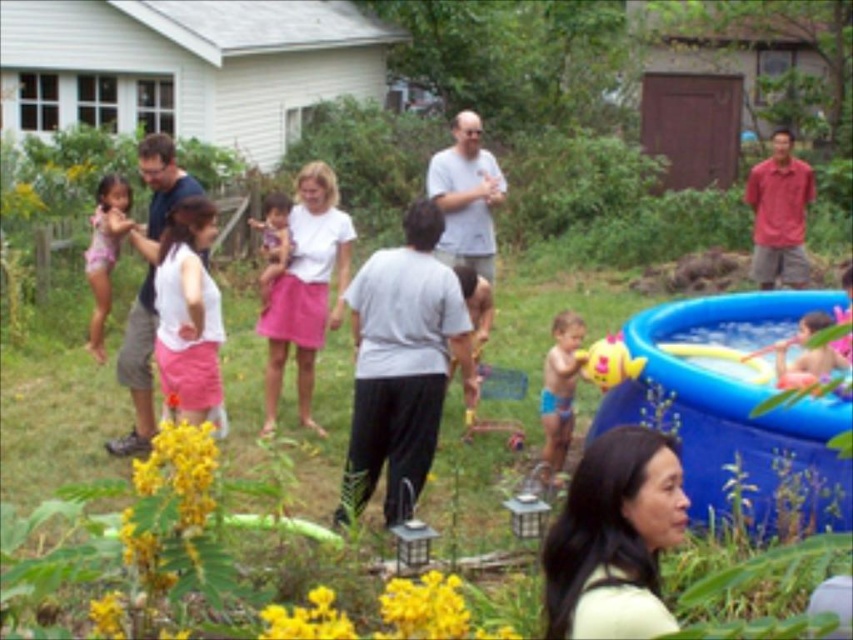
You are a parent at the gathering and want to place a new red beach ball between the blue inflatable pool at lower right and the yellow rubber duck at right. Based on their sizes, will the beach ball fit between them without overlapping?

The blue inflatable pool at lower right is much taller than the yellow rubber duck at right, so placing the red beach ball between them might be possible as there is enough vertical space. However, the exact horizontal distance isn not specified, so it depends on the ball size and spacing between the objects.

You are standing in the backyard and want to take a photo of both the point at coordinates (x=200, y=342) and the point at coordinates (x=114, y=202). Which point should you focus on first to ensure both are in clear view?

You should focus on point (x=200, y=342) first because it is closer to the camera than point (x=114, y=202). This ensures both points are in focus as the depth of field will cover the farther point.